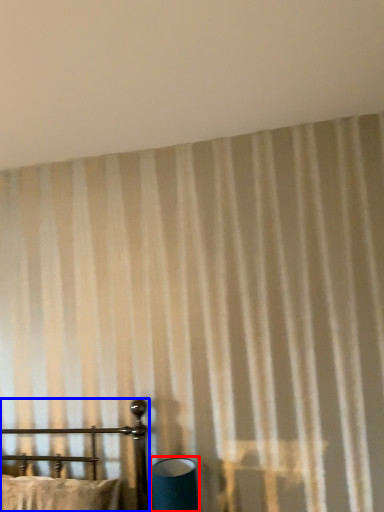
Question: Which of the following is the closest to the observer, table lamp (highlighted by a red box) or furniture (highlighted by a blue box)?

Choices:
 (A) table lamp
 (B) furniture

Answer: (B)